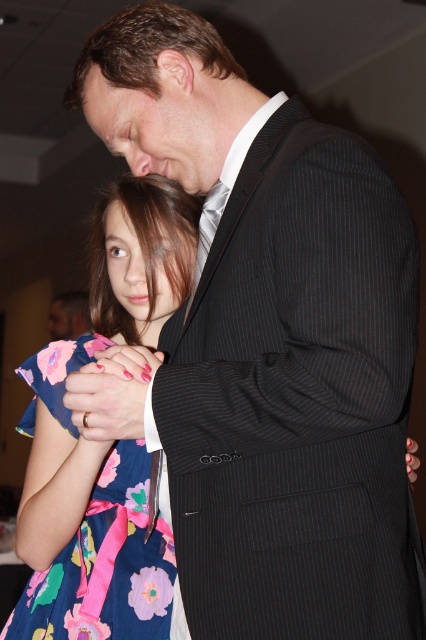
You are a photographer observing the scene. You notice the floral cotton dress at center and the matte black suit at upper center. Based on their positions, which object is closer to the bottom of the image?

The floral cotton dress at center is below the matte black suit at upper center, so it is closer to the bottom of the image.

You are a photographer observing the scene. You notice the floral cotton dress at center and the silky white tie at center. Which object is closer to you in this composition?

The floral cotton dress at center is closer to you than the silky white tie at center.